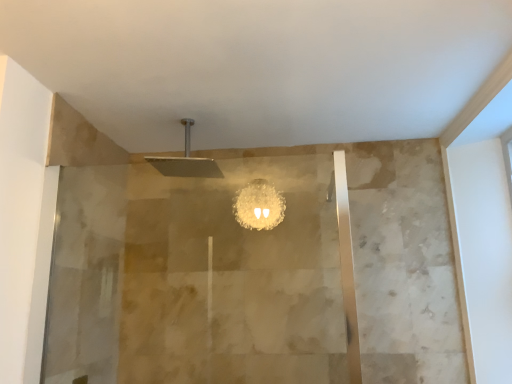
Describe the element at coordinates (186, 161) in the screenshot. I see `matte silver shower head at upper center` at that location.

Where is `matte silver shower head at upper center`? The width and height of the screenshot is (512, 384). matte silver shower head at upper center is located at coordinates (186, 161).

Identify the location of translucent glass screen door at left. (86, 276).

Describe the element at coordinates (86, 276) in the screenshot. I see `translucent glass screen door at left` at that location.

This screenshot has height=384, width=512. I want to click on matte silver shower head at upper center, so click(186, 161).

Considering the positions of objects matte silver shower head at upper center and translucent glass screen door at left in the image provided, who is more to the left, matte silver shower head at upper center or translucent glass screen door at left?

From the viewer's perspective, translucent glass screen door at left appears more on the left side.

Considering the positions of objects matte silver shower head at upper center and translucent glass screen door at left in the image provided, who is behind, matte silver shower head at upper center or translucent glass screen door at left?

matte silver shower head at upper center.

Considering the points (177, 175) and (113, 300), which point is behind, point (177, 175) or point (113, 300)?

Positioned behind is point (177, 175).

From the image's perspective, does matte silver shower head at upper center appear higher than translucent glass screen door at left?

Indeed, from the image's perspective, matte silver shower head at upper center is shown above translucent glass screen door at left.

From a real-world perspective, is matte silver shower head at upper center above or below translucent glass screen door at left?

From a real-world perspective, matte silver shower head at upper center is physically above translucent glass screen door at left.

In terms of width, does matte silver shower head at upper center look wider or thinner when compared to translucent glass screen door at left?

In the image, matte silver shower head at upper center appears to be wider than translucent glass screen door at left.

Looking at this image, who is shorter, matte silver shower head at upper center or translucent glass screen door at left?

Standing shorter between the two is matte silver shower head at upper center.

Between matte silver shower head at upper center and translucent glass screen door at left, which one has smaller size?

With smaller size is matte silver shower head at upper center.

Does matte silver shower head at upper center contain translucent glass screen door at left?

Definitely not — translucent glass screen door at left is not inside matte silver shower head at upper center.

Is matte silver shower head at upper center positioned far away from translucent glass screen door at left?

They are positioned close to each other.

From the picture: Is translucent glass screen door at left at the back of matte silver shower head at upper center?

matte silver shower head at upper center is not turned away from translucent glass screen door at left.

How different are the orientations of matte silver shower head at upper center and translucent glass screen door at left in degrees?

There is a 87.4-degree angle between the facing directions of matte silver shower head at upper center and translucent glass screen door at left.

Could you measure the distance between matte silver shower head at upper center and translucent glass screen door at left?

59.63 centimeters.

Find the location of a particular element. screen door in front of the matte silver shower head at upper center is located at coordinates (86, 276).

Which is more to the right, translucent glass screen door at left or matte silver shower head at upper center?

From the viewer's perspective, matte silver shower head at upper center appears more on the right side.

Considering their positions, is translucent glass screen door at left located in front of or behind matte silver shower head at upper center?

translucent glass screen door at left is in front of matte silver shower head at upper center.

Does point (74, 307) come farther from viewer compared to point (186, 149)?

No, it is in front of (186, 149).

From the image's perspective, between translucent glass screen door at left and matte silver shower head at upper center, which one is located above?

From the image's view, matte silver shower head at upper center is above.

From a real-world perspective, which is physically below, translucent glass screen door at left or matte silver shower head at upper center?

translucent glass screen door at left, from a real-world perspective.

Which of these two, translucent glass screen door at left or matte silver shower head at upper center, is thinner?

translucent glass screen door at left.

Who is shorter, translucent glass screen door at left or matte silver shower head at upper center?

With less height is matte silver shower head at upper center.

Can you confirm if translucent glass screen door at left is bigger than matte silver shower head at upper center?

Yes.

Choose the correct answer: Is translucent glass screen door at left inside matte silver shower head at upper center or outside it?

translucent glass screen door at left is not inside matte silver shower head at upper center, it's outside.

Would you consider translucent glass screen door at left to be distant from matte silver shower head at upper center?

That's not correct — translucent glass screen door at left is a little close to matte silver shower head at upper center.

Could you tell me if translucent glass screen door at left is turned towards matte silver shower head at upper center?

Yes.

Measure the distance between translucent glass screen door at left and matte silver shower head at upper center.

translucent glass screen door at left is 23.48 inches away from matte silver shower head at upper center.

The width and height of the screenshot is (512, 384). Find the location of `shower behind the translucent glass screen door at left`. shower behind the translucent glass screen door at left is located at coordinates (186, 161).

What are the coordinates of `shower lying on the right of translucent glass screen door at left` in the screenshot? It's located at (186, 161).

Where is `shower above the translucent glass screen door at left (from a real-world perspective)`? shower above the translucent glass screen door at left (from a real-world perspective) is located at coordinates (186, 161).